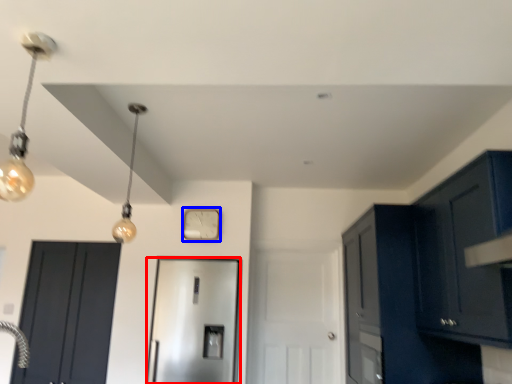
Question: Which object is further to the camera taking this photo, door (highlighted by a red box) or clock (highlighted by a blue box)?

Choices:
 (A) door
 (B) clock

Answer: (B)